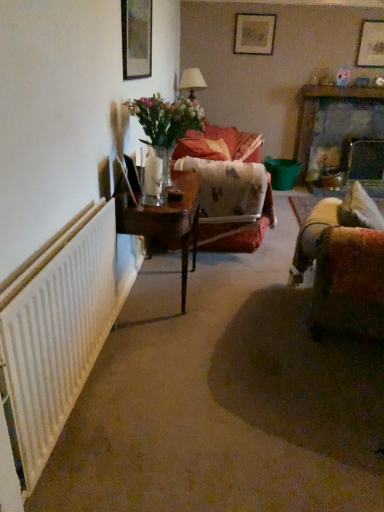
Question: Can you confirm if velvet floral couch at center is thinner than clear glass vase at center?

Choices:
 (A) yes
 (B) no

Answer: (B)

Question: Does velvet floral couch at center have a larger size compared to clear glass vase at center?

Choices:
 (A) yes
 (B) no

Answer: (A)

Question: Is velvet floral couch at center outside clear glass vase at center?

Choices:
 (A) no
 (B) yes

Answer: (B)

Question: Does velvet floral couch at center appear on the right side of clear glass vase at center?

Choices:
 (A) no
 (B) yes

Answer: (B)

Question: Considering the relative sizes of velvet floral couch at center and clear glass vase at center in the image provided, is velvet floral couch at center taller than clear glass vase at center?

Choices:
 (A) yes
 (B) no

Answer: (A)

Question: From the image's perspective, is velvet floral couch at center beneath clear glass vase at center?

Choices:
 (A) yes
 (B) no

Answer: (B)

Question: Is matte wooden picture frame at upper center, acting as the first picture frame starting from the back, aimed at wooden picture frame at upper right, marked as the 2th picture frame in a bottom-to-top arrangement?

Choices:
 (A) yes
 (B) no

Answer: (B)

Question: Can we say matte wooden picture frame at upper center, acting as the first picture frame starting from the back, lies outside wooden picture frame at upper right, the 2th picture frame in the front-to-back sequence?

Choices:
 (A) yes
 (B) no

Answer: (A)

Question: Can you confirm if matte wooden picture frame at upper center, the second picture frame in the right-to-left sequence, is smaller than wooden picture frame at upper right, the 2th picture frame in the front-to-back sequence?

Choices:
 (A) no
 (B) yes

Answer: (B)

Question: From a real-world perspective, is matte wooden picture frame at upper center, the 2th picture frame from the left, physically above wooden picture frame at upper right, the 3th picture frame viewed from the left?

Choices:
 (A) yes
 (B) no

Answer: (A)

Question: Are matte wooden picture frame at upper center, the second picture frame in the right-to-left sequence, and wooden picture frame at upper right, the second picture frame positioned from the back, far apart?

Choices:
 (A) no
 (B) yes

Answer: (B)

Question: Is matte wooden picture frame at upper center, positioned as the 3th picture frame in front-to-back order, shorter than wooden picture frame at upper right, the second picture frame positioned from the back?

Choices:
 (A) yes
 (B) no

Answer: (A)

Question: Is wooden picture frame at upper left, acting as the 1th picture frame starting from the left, looking in the opposite direction of velvet brown couch at right?

Choices:
 (A) no
 (B) yes

Answer: (A)